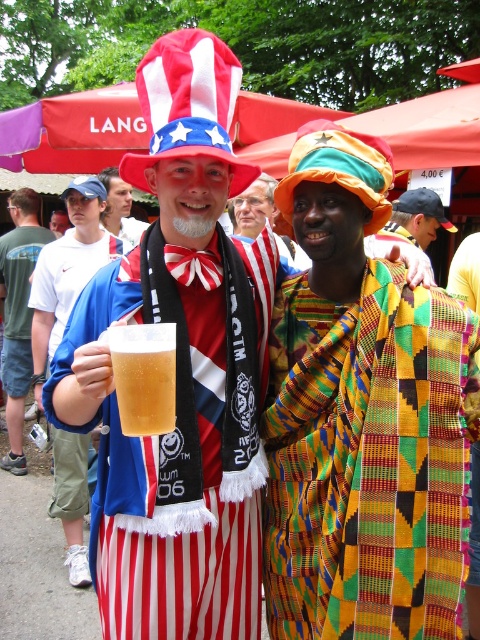
You are standing in the outdoor event area and want to determine which of the two points, point (372, 419) or point (23, 252), is nearer to you. Based on the scene, which point is closer?

Point (372, 419) is closer to the viewer than point (23, 252).